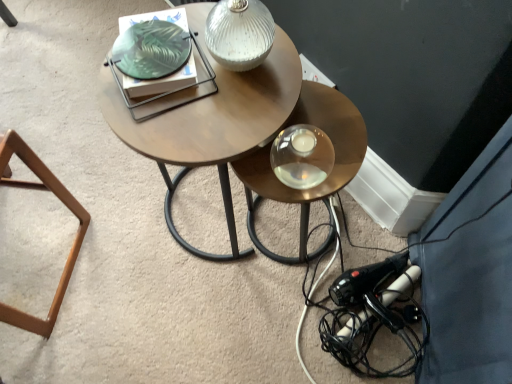
In order to click on vacant area that is in front of white textured glass table lamp at upper center in this screenshot , I will do tap(225, 123).